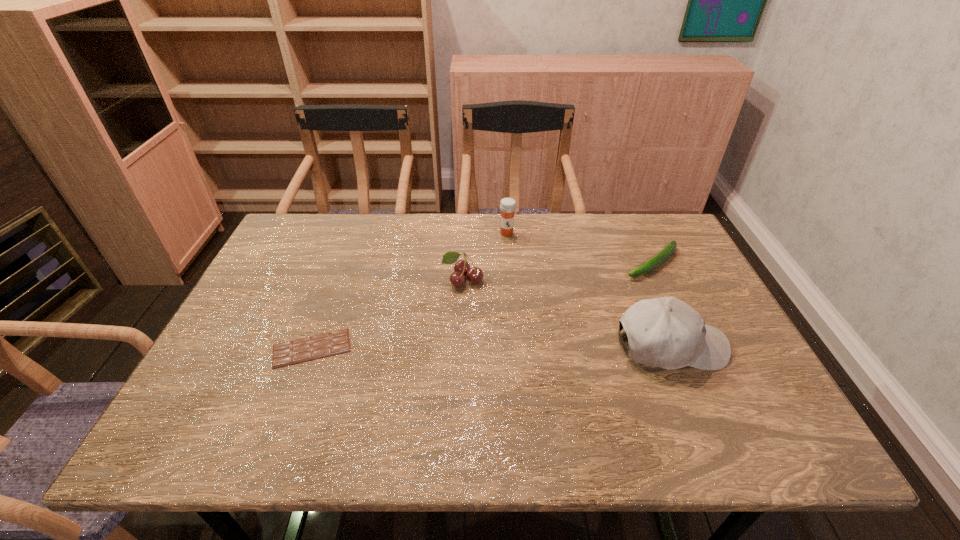
You are a GUI agent. You are given a task and a screenshot of the screen. Output one action in this format:
    pyautogui.click(x=<x>, y=<y>)
    Task: Click on the object at the near edge
    
    Given the screenshot: What is the action you would take?
    pyautogui.click(x=665, y=332)

Locate an element on the screen. This screenshot has width=960, height=540. object located at the left edge is located at coordinates (305, 349).

The height and width of the screenshot is (540, 960). I want to click on baseball cap located in the right edge section of the desktop, so click(665, 332).

Locate an element on the screen. zucchini located in the right edge section of the desktop is located at coordinates (667, 251).

The image size is (960, 540). What are the coordinates of `object situated at the far right corner` in the screenshot? It's located at (667, 251).

Image resolution: width=960 pixels, height=540 pixels. In order to click on object situated at the near right corner in this screenshot , I will do `click(665, 332)`.

In the image, there is a desktop. Identify the location of vacant space at the far edge. (592, 231).

In the image, there is a desktop. At what (x,y) coordinates should I click in order to perform the action: click on vacant space at the near edge. Please return your answer as a coordinate pair (x, y). The image size is (960, 540). Looking at the image, I should click on (582, 402).

Where is `vacant space at the left edge of the desktop`? This screenshot has width=960, height=540. vacant space at the left edge of the desktop is located at coordinates (275, 282).

This screenshot has height=540, width=960. In order to click on free space at the right edge of the desktop in this screenshot , I will do `click(664, 272)`.